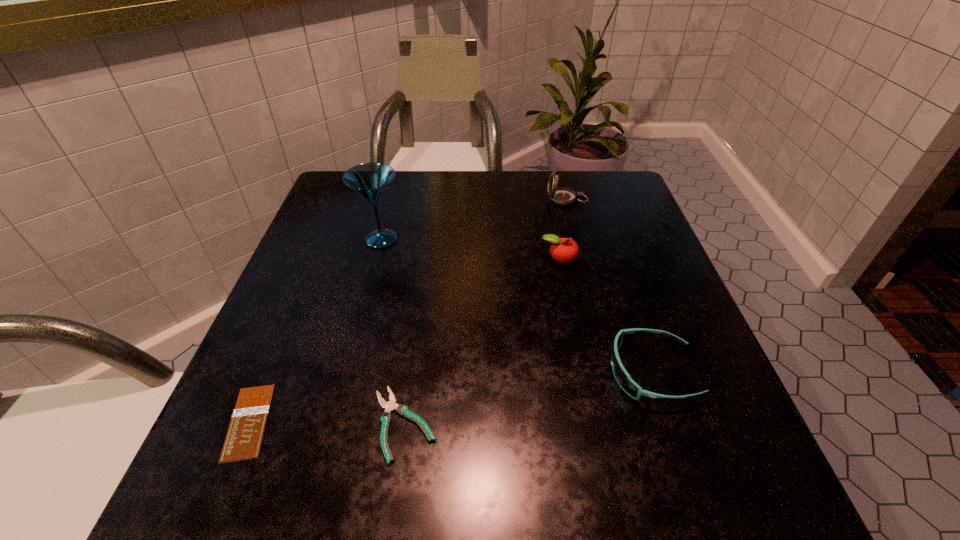
Locate an element on the screen. vacant region at the near edge of the desktop is located at coordinates (368, 482).

The width and height of the screenshot is (960, 540). In the image, there is a desktop. Find the location of `vacant space at the left edge`. vacant space at the left edge is located at coordinates (298, 261).

In the image, there is a desktop. At what (x,y) coordinates should I click in order to perform the action: click on vacant space at the right edge. Please return your answer as a coordinate pair (x, y). Looking at the image, I should click on (668, 377).

Identify the location of free spot at the far left corner of the desktop. This screenshot has height=540, width=960. (335, 218).

You are a GUI agent. You are given a task and a screenshot of the screen. Output one action in this format:
    pyautogui.click(x=<x>, y=<y>)
    Task: Click on the vacant space at the far right corner of the desktop
    The height and width of the screenshot is (540, 960).
    Given the screenshot: What is the action you would take?
    point(596,221)

In the image, there is a desktop. At what (x,y) coordinates should I click in order to perform the action: click on vacant space at the near right corner. Please return your answer as a coordinate pair (x, y). This screenshot has width=960, height=540. Looking at the image, I should click on (691, 478).

Image resolution: width=960 pixels, height=540 pixels. What are the coordinates of `free spot between the apple and the sunglasses` in the screenshot? It's located at (606, 315).

In order to click on vacant point located between the fifth object from right to left and the farthest object in this screenshot , I will do `click(474, 219)`.

This screenshot has height=540, width=960. Identify the location of free area in between the compass and the sunglasses. (610, 286).

The width and height of the screenshot is (960, 540). What are the coordinates of `unoccupied position between the pliers and the sunglasses` in the screenshot? It's located at (528, 398).